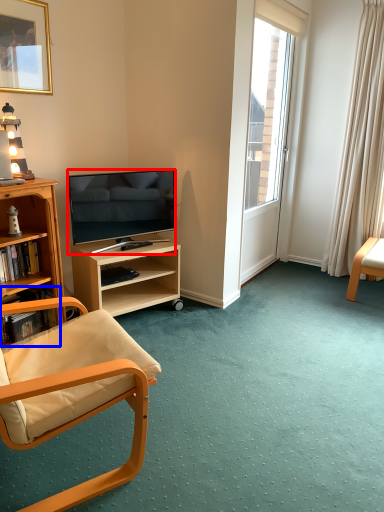
Question: Among these objects, which one is farthest to the camera, television (highlighted by a red box) or shelf (highlighted by a blue box)?

Choices:
 (A) television
 (B) shelf

Answer: (A)